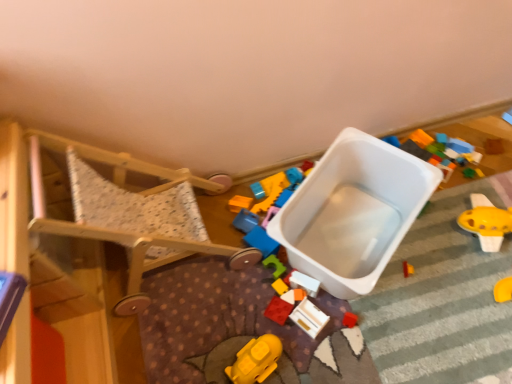
Locate an element on the screen. Image resolution: width=512 pixels, height=384 pixels. vacant area that lies in front of wooden toy at center, the second toy in the right-to-left sequence is located at coordinates (321, 358).